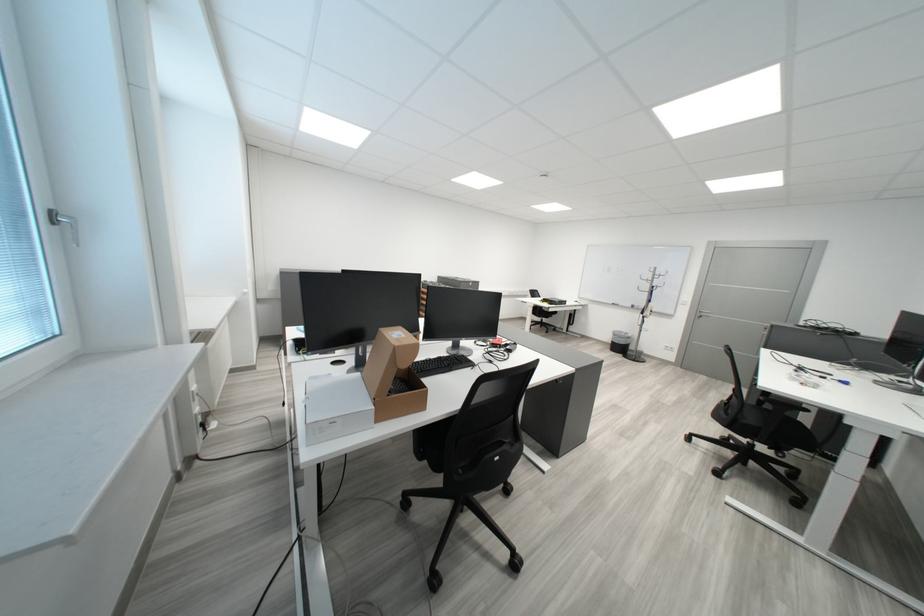
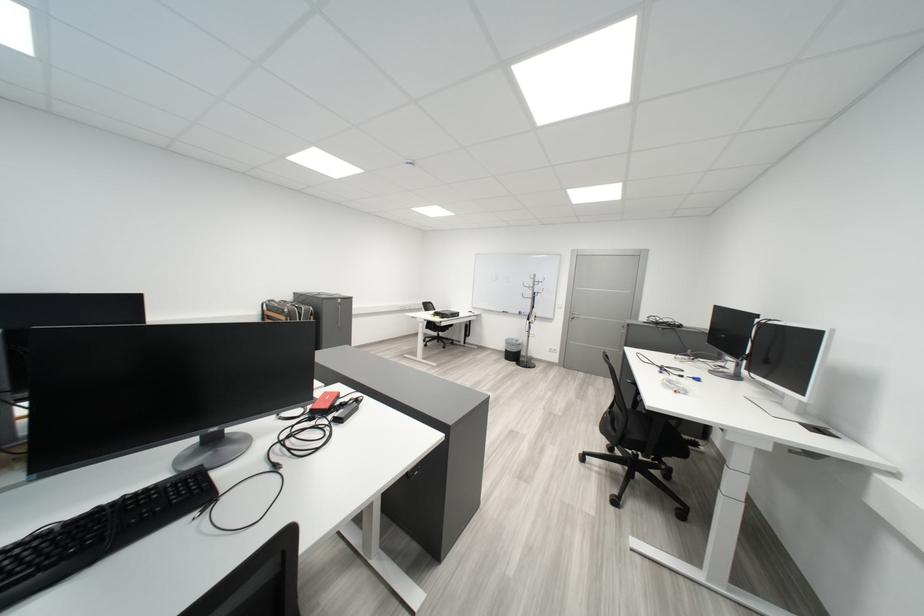
Question: How did the camera likely rotate?

Choices:
 (A) Left
 (B) Right
 (C) Up
 (D) Down

Answer: (B)